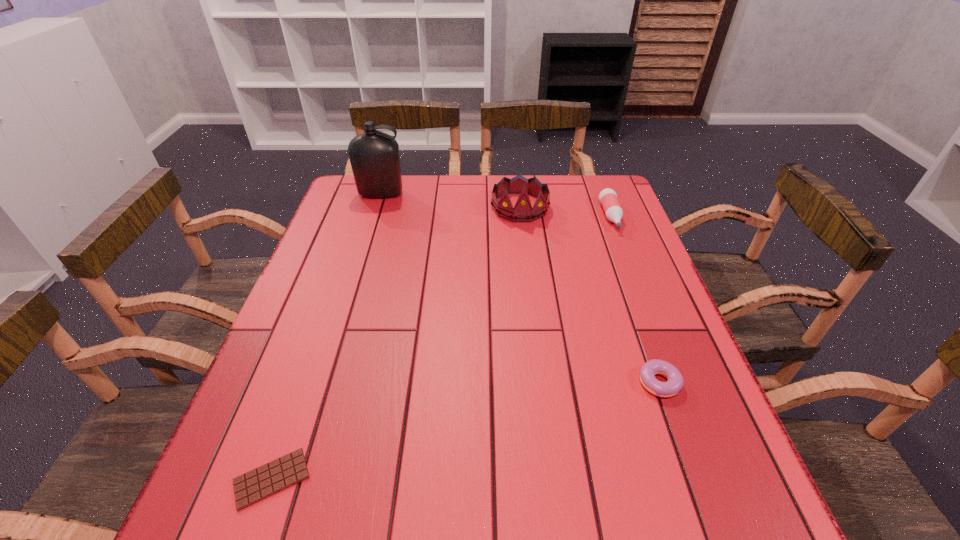
This screenshot has height=540, width=960. What are the coordinates of `the left bottle` in the screenshot? It's located at (374, 156).

Find the location of a particular element. The width and height of the screenshot is (960, 540). the taller bottle is located at coordinates (374, 156).

Identify the location of the third object from left to right. Image resolution: width=960 pixels, height=540 pixels. (522, 212).

This screenshot has height=540, width=960. I want to click on tiara, so click(522, 212).

Find the location of a particular element. The height and width of the screenshot is (540, 960). the shorter bottle is located at coordinates (608, 198).

Locate an element on the screen. The width and height of the screenshot is (960, 540). the third tallest object is located at coordinates (608, 198).

Identify the location of the second shortest object. This screenshot has height=540, width=960. coord(675,382).

You are a GUI agent. You are given a task and a screenshot of the screen. Output one action in this format:
    pyautogui.click(x=<x>, y=<y>)
    Task: Click on the doughnut
    The image size is (960, 540).
    Given the screenshot: What is the action you would take?
    pyautogui.click(x=675, y=382)

This screenshot has height=540, width=960. Identify the location of the shortest object. (260, 483).

The height and width of the screenshot is (540, 960). Identify the location of the nearest object. (260, 483).